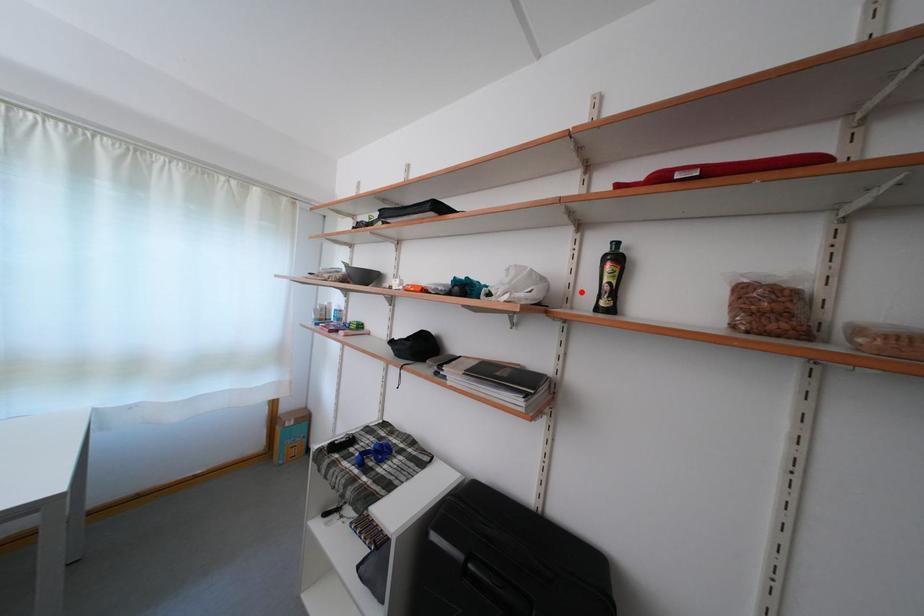
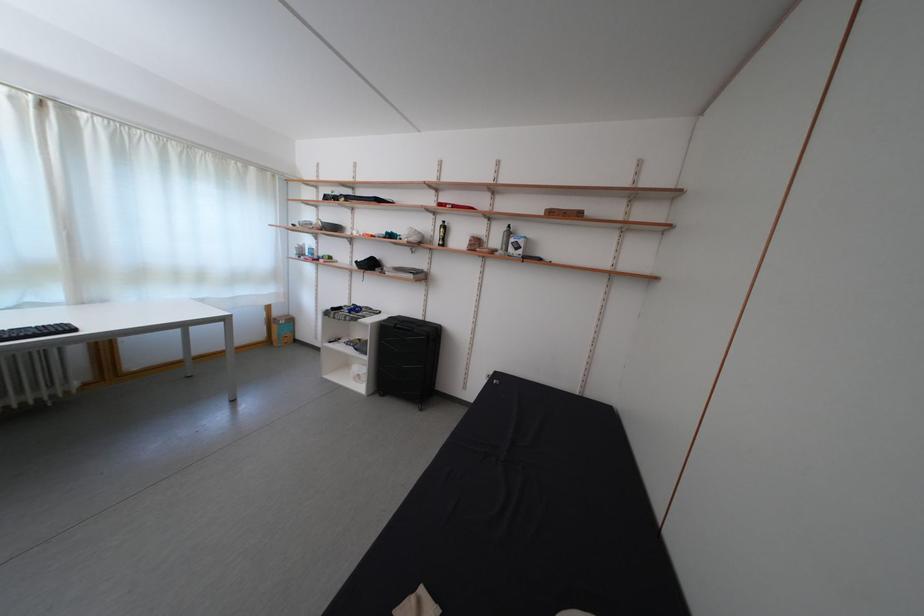
The point at the highlighted location is marked in the first image. Where is the corresponding point in the second image?

(442, 241)